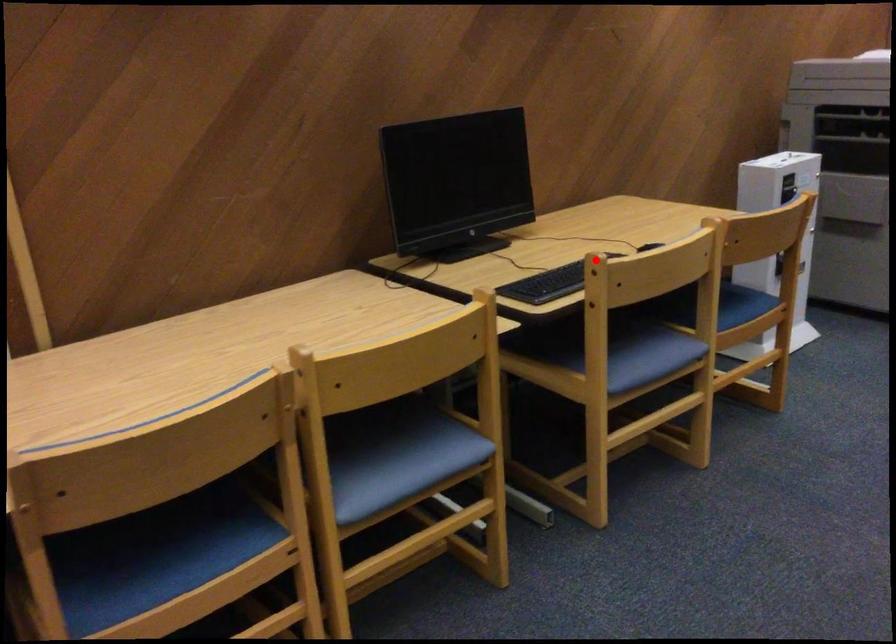
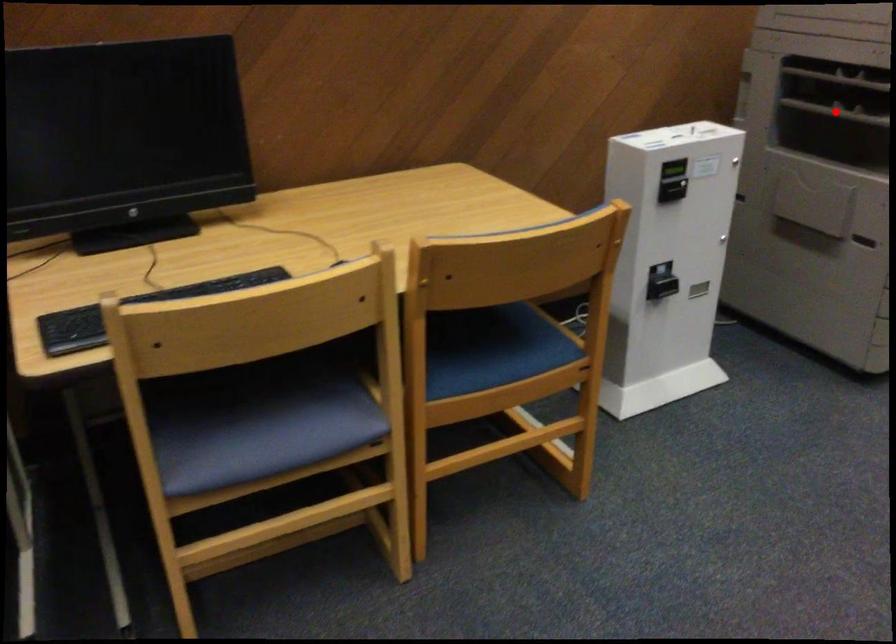
From the picture: I am providing you with two images of the same scene from different viewpoints. A red point is marked on the first image and another point is marked on the second image. Is the red point in image1 aligned with the point shown in image2?

No